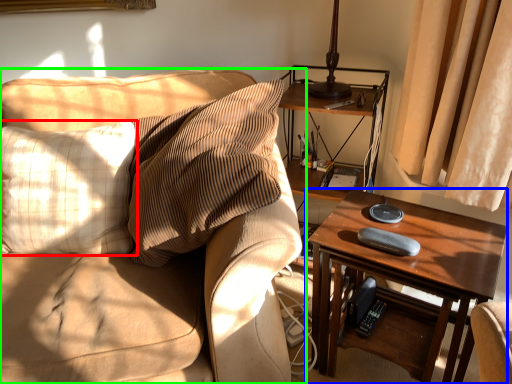
Question: Which object is positioned farthest from pillow (highlighted by a red box)? Select from table (highlighted by a blue box) and studio couch (highlighted by a green box).

Choices:
 (A) table
 (B) studio couch

Answer: (A)